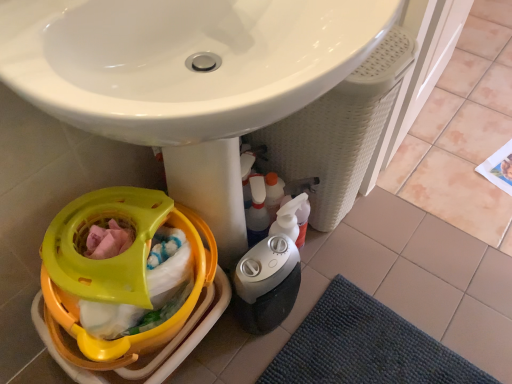
Question: Can you confirm if yellow plastic baby carriage at lower left is taller than gray plastic humidifier at lower center?

Choices:
 (A) no
 (B) yes

Answer: (A)

Question: From a real-world perspective, is yellow plastic baby carriage at lower left located beneath gray plastic humidifier at lower center?

Choices:
 (A) yes
 (B) no

Answer: (B)

Question: Does yellow plastic baby carriage at lower left turn towards gray plastic humidifier at lower center?

Choices:
 (A) no
 (B) yes

Answer: (A)

Question: Considering the relative sizes of yellow plastic baby carriage at lower left and gray plastic humidifier at lower center in the image provided, is yellow plastic baby carriage at lower left bigger than gray plastic humidifier at lower center?

Choices:
 (A) no
 (B) yes

Answer: (B)

Question: Is yellow plastic baby carriage at lower left positioned behind gray plastic humidifier at lower center?

Choices:
 (A) yes
 (B) no

Answer: (B)

Question: Is yellow plastic baby carriage at lower left oriented away from gray plastic humidifier at lower center?

Choices:
 (A) no
 (B) yes

Answer: (A)

Question: Is gray plastic humidifier at lower center not near translucent plastic spray bottle at lower center?

Choices:
 (A) yes
 (B) no

Answer: (B)

Question: From a real-world perspective, is gray plastic humidifier at lower center below translucent plastic spray bottle at lower center?

Choices:
 (A) no
 (B) yes

Answer: (B)

Question: Is translucent plastic spray bottle at lower center a part of gray plastic humidifier at lower center?

Choices:
 (A) yes
 (B) no

Answer: (B)

Question: From the image's perspective, is gray plastic humidifier at lower center above translucent plastic spray bottle at lower center?

Choices:
 (A) no
 (B) yes

Answer: (A)

Question: From a real-world perspective, is gray plastic humidifier at lower center on top of translucent plastic spray bottle at lower center?

Choices:
 (A) yes
 (B) no

Answer: (B)

Question: Can you confirm if gray plastic humidifier at lower center is taller than translucent plastic spray bottle at lower center?

Choices:
 (A) yes
 (B) no

Answer: (B)

Question: Is dark blue textured bath mat at lower right bigger than gray plastic humidifier at lower center?

Choices:
 (A) yes
 (B) no

Answer: (B)